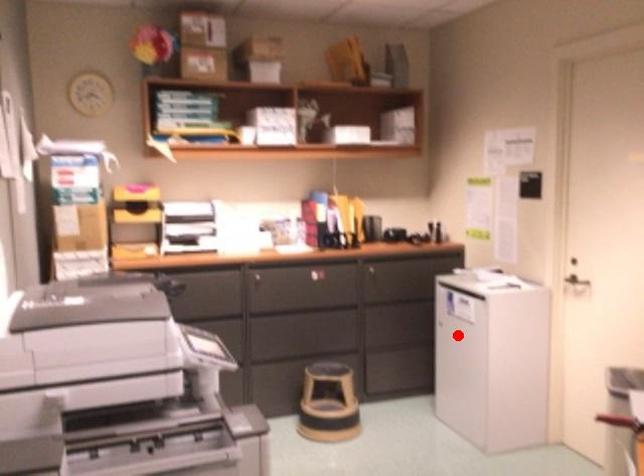
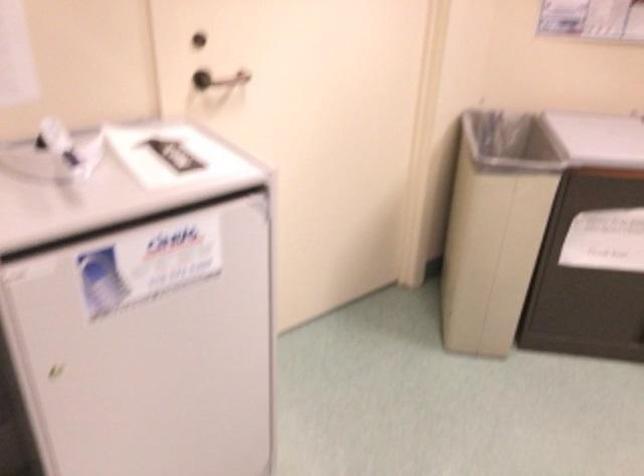
Question: I am providing you with two images of the same scene from different viewpoints. Given a red point in image1, look at the same physical point in image2. Is it:

Choices:
 (A) Closer to the viewpoint
 (B) Farther from the viewpoint

Answer: (A)